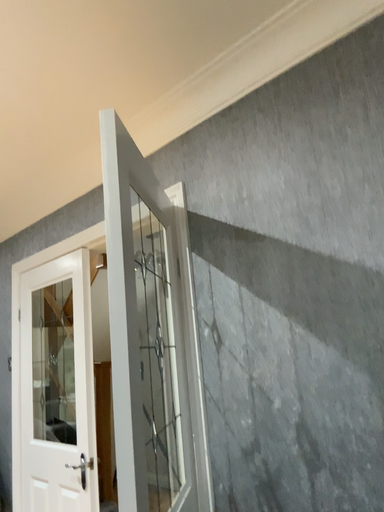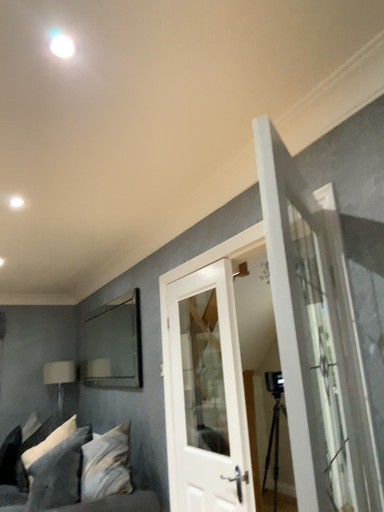
Question: Which way did the camera rotate in the video?

Choices:
 (A) rotated right
 (B) rotated left

Answer: (B)